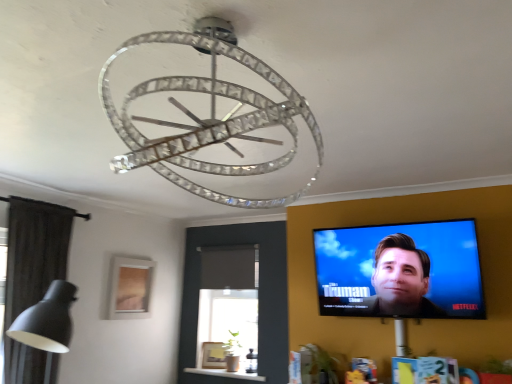
Question: Considering the positions of matte black tv at upper right and clear crystal chandelier at center in the image, is matte black tv at upper right taller or shorter than clear crystal chandelier at center?

Choices:
 (A) tall
 (B) short

Answer: (A)

Question: Based on their positions, is matte black tv at upper right located to the left or right of clear crystal chandelier at center?

Choices:
 (A) left
 (B) right

Answer: (B)

Question: Based on their relative distances, which object is nearer to the clear crystal chandelier at center?

Choices:
 (A) matte wooden picture frame at lower left
 (B) matte black tv at upper right

Answer: (B)

Question: Estimate the real-world distances between objects in this image. Which object is farther from the matte black tv at upper right?

Choices:
 (A) matte wooden picture frame at lower left
 (B) clear crystal chandelier at center

Answer: (A)